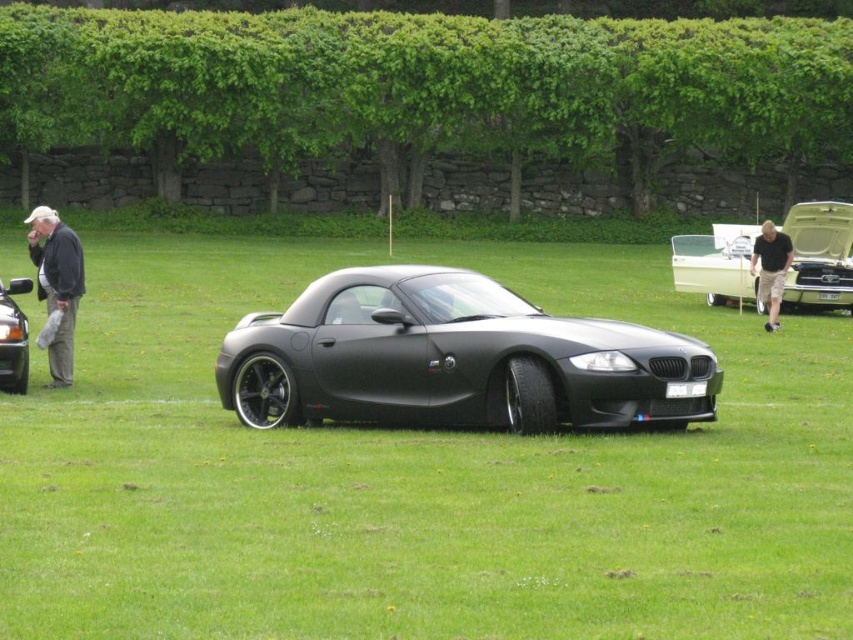
Is point (642, 365) positioned after point (720, 266)?

That is False.

Identify the location of matte black sports car at center. Image resolution: width=853 pixels, height=640 pixels. (454, 358).

Is gray fabric pants at left thinner than black cotton shorts at center?

No, gray fabric pants at left is not thinner than black cotton shorts at center.

Can you confirm if gray fabric pants at left is taller than black cotton shorts at center?

Correct, gray fabric pants at left is much taller as black cotton shorts at center.

I want to click on gray fabric pants at left, so click(x=57, y=284).

Looking at this image, who is higher up, matte black car at center or black cotton shorts at center?

matte black car at center is above.

Who is positioned more to the right, matte black car at center or black cotton shorts at center?

matte black car at center is more to the right.

What do you see at coordinates (819, 253) in the screenshot? I see `matte black car at center` at bounding box center [819, 253].

Image resolution: width=853 pixels, height=640 pixels. In order to click on matte black car at center in this screenshot , I will do `click(819, 253)`.